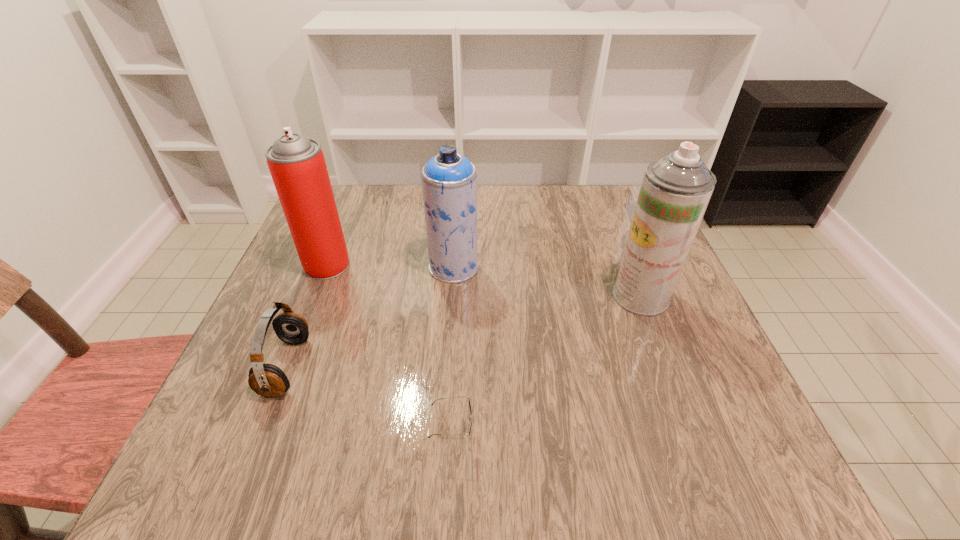
Locate an element on the screen. the rightmost object is located at coordinates (675, 191).

Locate an element on the screen. the leftmost aerosol can is located at coordinates (296, 163).

This screenshot has height=540, width=960. I want to click on the second aerosol can from left to right, so click(x=449, y=180).

You are a GUI agent. You are given a task and a screenshot of the screen. Output one action in this format:
    pyautogui.click(x=<x>, y=<y>)
    Task: Click on the second shortest object
    This screenshot has height=540, width=960.
    Given the screenshot: What is the action you would take?
    pyautogui.click(x=267, y=380)

You are a GUI agent. You are given a task and a screenshot of the screen. Output one action in this format:
    pyautogui.click(x=<x>, y=<y>)
    Task: Click on the shortest object
    This screenshot has width=960, height=540.
    Given the screenshot: What is the action you would take?
    pyautogui.click(x=470, y=404)

You are a GUI agent. You are given a task and a screenshot of the screen. Output one action in this format:
    pyautogui.click(x=<x>, y=<y>)
    Task: Click on the vacant area situated 0.300m on the left of the rightmost aerosol can
    
    Given the screenshot: What is the action you would take?
    pyautogui.click(x=476, y=296)

Image resolution: width=960 pixels, height=540 pixels. Find the location of `vacant position located on the front of the leftmost aerosol can`. vacant position located on the front of the leftmost aerosol can is located at coordinates (270, 409).

I want to click on free space located 0.110m on the front of the second aerosol can from left to right, so click(450, 320).

Find the location of a particular element. free space located 0.250m on the ear cups of the headset is located at coordinates (437, 367).

The image size is (960, 540). What are the coordinates of `vacant space located in front of the lenses of the shortest object` in the screenshot? It's located at pos(614,435).